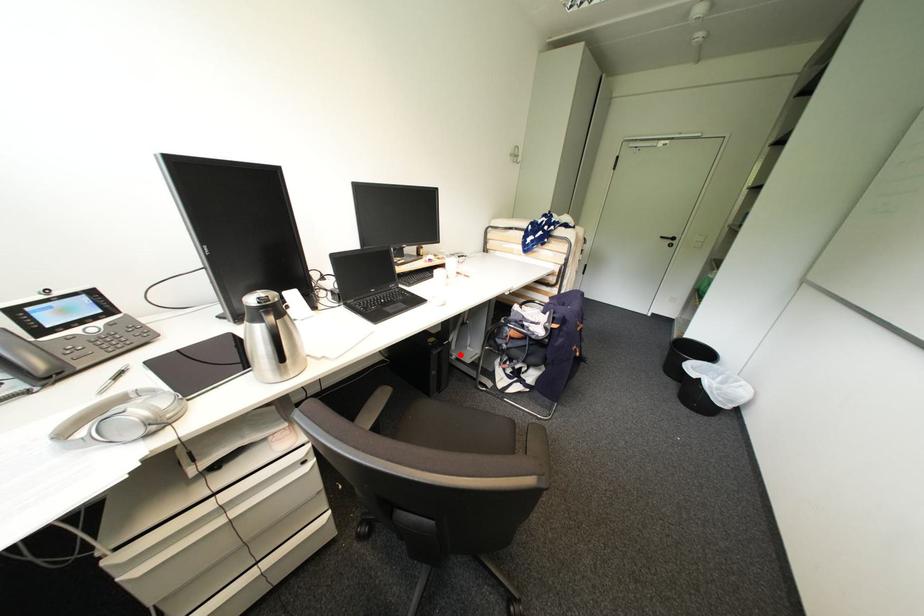
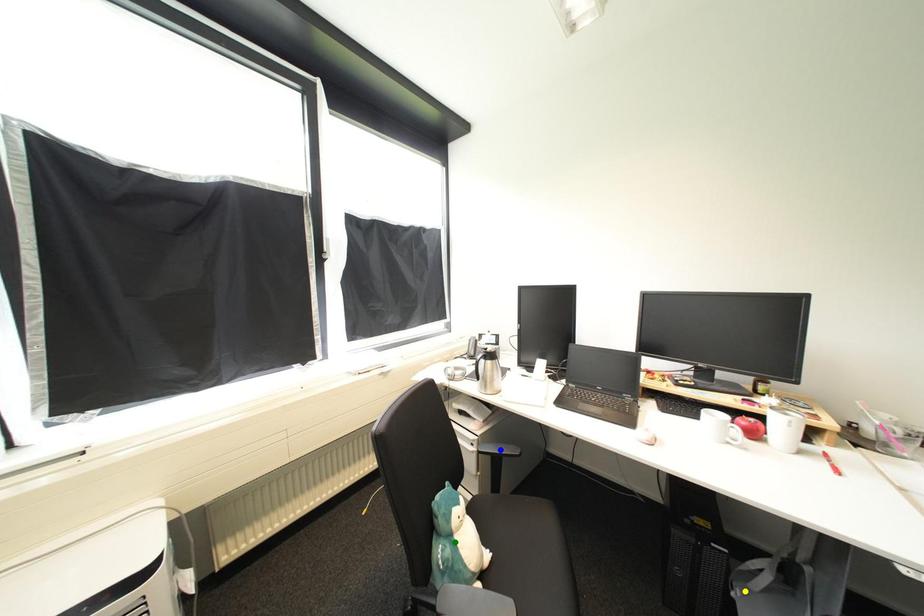
Question: I am providing you with two images of the same scene from different viewpoints. A red point is marked on the first image. You are given multiple points on the second image. Which point in image 2 represents the same 3d spot as the red point in image 1?

Choices:
 (A) blue point
 (B) green point
 (C) yellow point

Answer: (C)